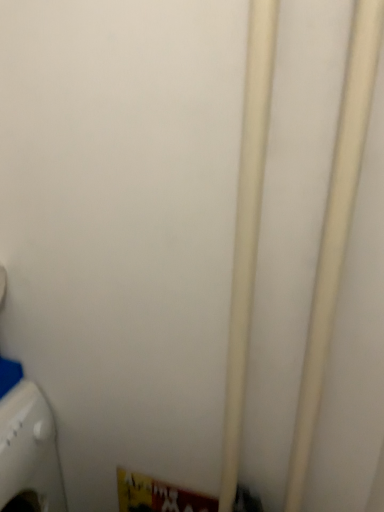
Measure the distance between point (335, 266) and camera.

The depth of point (335, 266) is 75.70 centimeters.

What do you see at coordinates (335, 232) in the screenshot? I see `white matte pipe at center, arranged as the 1th pipe when viewed from the right` at bounding box center [335, 232].

In order to face white matte pipe at center, the first pipe positioned from the left, should I rotate leftwards or rightwards?

You should look right and rotate roughly 5.834 degrees.

What do you see at coordinates (247, 230) in the screenshot?
I see `white matte pipe at center, the first pipe positioned from the left` at bounding box center [247, 230].

Where is `white matte pipe at center, arranged as the 1th pipe when viewed from the right`? white matte pipe at center, arranged as the 1th pipe when viewed from the right is located at coordinates (335, 232).

Could you measure the distance between white matte pipe at center, which is the second pipe in left-to-right order, and white matte pipe at center, the 2th pipe viewed from the right?

white matte pipe at center, which is the second pipe in left-to-right order, is 5.55 inches away from white matte pipe at center, the 2th pipe viewed from the right.

Are white matte pipe at center, which is the second pipe in left-to-right order, and white matte pipe at center, the first pipe positioned from the left, far apart?

No.

I want to click on pipe below the white matte pipe at center, arranged as the 1th pipe when viewed from the right (from the image's perspective), so click(x=247, y=230).

Would you say white matte pipe at center, which is the second pipe in left-to-right order, is inside or outside white matte pipe at center, the first pipe positioned from the left?

The correct answer is: outside.

Is point (2, 419) positioned in front of point (336, 298)?

No.

The width and height of the screenshot is (384, 512). I want to click on home appliance located behind the white matte pipe at center, arranged as the 1th pipe when viewed from the right, so click(x=29, y=451).

From a real-world perspective, which object rests below the other?

white plastic washing machine at lower left, from a real-world perspective.

Considering the sizes of white plastic washing machine at lower left and white matte pipe at center, arranged as the 1th pipe when viewed from the right, in the image, is white plastic washing machine at lower left bigger or smaller than white matte pipe at center, arranged as the 1th pipe when viewed from the right,?

In the image, white plastic washing machine at lower left appears to be larger than white matte pipe at center, arranged as the 1th pipe when viewed from the right.

Is white matte pipe at center, the first pipe positioned from the left, completely or partially outside of white matte pipe at center, which is the second pipe in left-to-right order?

Yes.

Does white matte pipe at center, the 2th pipe viewed from the right, turn towards white matte pipe at center, which is the second pipe in left-to-right order?

No, white matte pipe at center, the 2th pipe viewed from the right, does not turn towards white matte pipe at center, which is the second pipe in left-to-right order.

The image size is (384, 512). I want to click on pipe on the right of white matte pipe at center, the first pipe positioned from the left, so click(x=335, y=232).

Does white matte pipe at center, the first pipe positioned from the left, have a lesser height compared to white matte pipe at center, arranged as the 1th pipe when viewed from the right?

Incorrect, the height of white matte pipe at center, the first pipe positioned from the left, does not fall short of that of white matte pipe at center, arranged as the 1th pipe when viewed from the right.

Where is `home appliance located behind the white matte pipe at center, arranged as the 1th pipe when viewed from the right`? Image resolution: width=384 pixels, height=512 pixels. home appliance located behind the white matte pipe at center, arranged as the 1th pipe when viewed from the right is located at coordinates (29, 451).

Which is in front, point (333, 195) or point (23, 479)?

The point (333, 195) is closer.

How many degrees apart are the facing directions of white matte pipe at center, which is the second pipe in left-to-right order, and white plastic washing machine at lower left?

They differ by 92.1 degrees in their facing directions.

Does white matte pipe at center, which is the second pipe in left-to-right order, appear on the right side of white plastic washing machine at lower left?

Correct, you'll find white matte pipe at center, which is the second pipe in left-to-right order, to the right of white plastic washing machine at lower left.

Is white plastic washing machine at lower left completely or partially outside of white matte pipe at center, the 2th pipe viewed from the right?

Yes, white plastic washing machine at lower left is not within white matte pipe at center, the 2th pipe viewed from the right.

Which is behind, white plastic washing machine at lower left or white matte pipe at center, the first pipe positioned from the left?

white plastic washing machine at lower left is further from the camera.

Considering the sizes of objects white plastic washing machine at lower left and white matte pipe at center, the first pipe positioned from the left, in the image provided, who is wider, white plastic washing machine at lower left or white matte pipe at center, the first pipe positioned from the left,?

white plastic washing machine at lower left is wider.

From a real-world perspective, does white matte pipe at center, the first pipe positioned from the left, stand above white plastic washing machine at lower left?

Yes, from a real-world perspective, white matte pipe at center, the first pipe positioned from the left, is over white plastic washing machine at lower left

Is white matte pipe at center, the 2th pipe viewed from the right, touching white plastic washing machine at lower left?

No, white matte pipe at center, the 2th pipe viewed from the right, is not next to white plastic washing machine at lower left.

Does white matte pipe at center, the first pipe positioned from the left, have a lesser height compared to white plastic washing machine at lower left?

No, white matte pipe at center, the first pipe positioned from the left, is not shorter than white plastic washing machine at lower left.

Which object is positioned more to the right, white matte pipe at center, the first pipe positioned from the left, or white plastic washing machine at lower left?

Positioned to the right is white matte pipe at center, the first pipe positioned from the left.

I want to click on pipe that is behind the white matte pipe at center, arranged as the 1th pipe when viewed from the right, so tap(247, 230).

Which pipe is the 2nd one when counting from the right side of the white plastic washing machine at lower left? Please provide its 2D coordinates.

[(335, 232)]

Looking at the image, which one is located closer to white plastic washing machine at lower left, white matte pipe at center, the 2th pipe viewed from the right, or white matte pipe at center, arranged as the 1th pipe when viewed from the right?

Among the two, white matte pipe at center, the 2th pipe viewed from the right, is located nearer to white plastic washing machine at lower left.

Considering their positions, is white plastic washing machine at lower left positioned further to white matte pipe at center, which is the second pipe in left-to-right order, than white matte pipe at center, the 2th pipe viewed from the right?

The object further to white matte pipe at center, which is the second pipe in left-to-right order, is white plastic washing machine at lower left.

Which object lies further to the anchor point white plastic washing machine at lower left, white matte pipe at center, which is the second pipe in left-to-right order, or white matte pipe at center, the 2th pipe viewed from the right?

white matte pipe at center, which is the second pipe in left-to-right order, is positioned further to the anchor white plastic washing machine at lower left.

Looking at this image, based on their spatial positions, is white plastic washing machine at lower left or white matte pipe at center, arranged as the 1th pipe when viewed from the right, closer to white matte pipe at center, the 2th pipe viewed from the right?

white matte pipe at center, arranged as the 1th pipe when viewed from the right, is closer to white matte pipe at center, the 2th pipe viewed from the right.

Estimate the real-world distances between objects in this image. Which object is further from white matte pipe at center, the first pipe positioned from the left, white matte pipe at center, which is the second pipe in left-to-right order, or white plastic washing machine at lower left?

white plastic washing machine at lower left.

Estimate the real-world distances between objects in this image. Which object is further from white matte pipe at center, which is the second pipe in left-to-right order, white matte pipe at center, the first pipe positioned from the left, or white plastic washing machine at lower left?

Among the two, white plastic washing machine at lower left is located further to white matte pipe at center, which is the second pipe in left-to-right order.

I want to click on pipe located between white plastic washing machine at lower left and white matte pipe at center, arranged as the 1th pipe when viewed from the right, in the left-right direction, so click(247, 230).